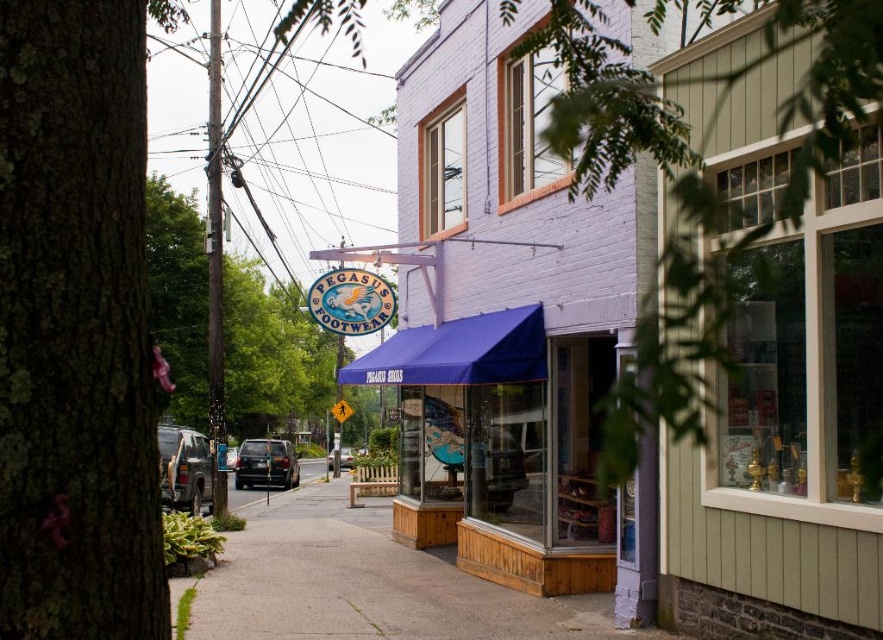
Question: Is purple brick building at center further to the viewer compared to matte black suv at center?

Choices:
 (A) yes
 (B) no

Answer: (B)

Question: Is green leafy tree at center wider than matte black suv at center?

Choices:
 (A) no
 (B) yes

Answer: (B)

Question: Can you confirm if purple brick building at center is positioned above matte black suv at center?

Choices:
 (A) no
 (B) yes

Answer: (B)

Question: Which point is farther to the camera?

Choices:
 (A) shiny black suv at center
 (B) green leafy tree at center
 (C) green rough bark tree at left
 (D) smooth concrete sidewalk at center

Answer: (A)

Question: Which object is the closest to the blue fabric awning at center?

Choices:
 (A) matte black suv at center
 (B) smooth concrete sidewalk at center
 (C) green rough bark tree at left
 (D) matte gray suv at left

Answer: (B)

Question: Which of these objects is positioned closest to the shiny black suv at center?

Choices:
 (A) smooth concrete sidewalk at center
 (B) green rough bark tree at left

Answer: (A)